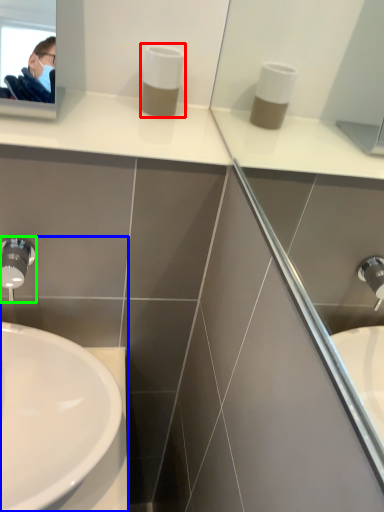
Question: Which object is positioned closest to soap dispenser (highlighted by a red box)? Select from sink (highlighted by a blue box) and tap (highlighted by a green box).

Choices:
 (A) sink
 (B) tap

Answer: (B)